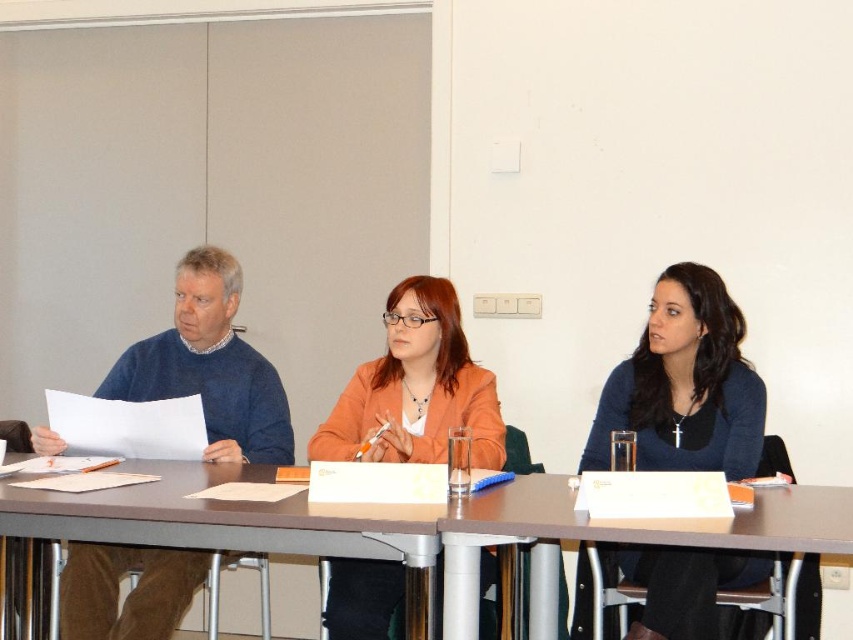
Question: Is dark blue sweater at center further to camera compared to blue sweater at left?

Choices:
 (A) yes
 (B) no

Answer: (B)

Question: Among these points, which one is nearest to the camera?

Choices:
 (A) (42, 451)
 (B) (363, 566)

Answer: (B)

Question: Which object is closer to the camera taking this photo?

Choices:
 (A) smooth wooden table at center
 (B) dark blue sweater at center
 (C) orange matte jacket at center
 (D) blue sweater at left

Answer: (A)

Question: Is smooth wooden table at center below smooth brown table at center?

Choices:
 (A) yes
 (B) no

Answer: (A)

Question: Which object is farther from the camera taking this photo?

Choices:
 (A) orange matte jacket at center
 (B) blue sweater at left
 (C) dark blue sweater at center
 (D) smooth wooden table at center

Answer: (B)

Question: Can you confirm if smooth wooden table at center is bigger than smooth brown table at center?

Choices:
 (A) no
 (B) yes

Answer: (B)